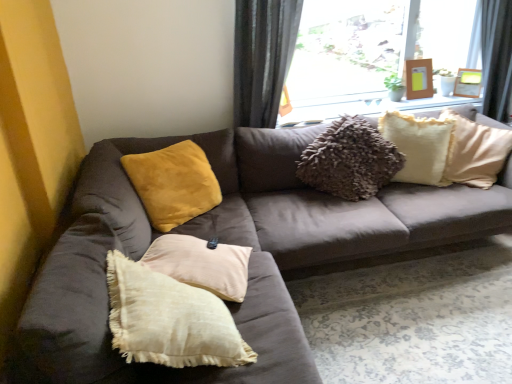
Find the location of a particular element. Image resolution: width=512 pixels, height=384 pixels. free location to the left of wooden picture frame at upper right, which ranks as the first picture frame in right-to-left order is located at coordinates tap(450, 96).